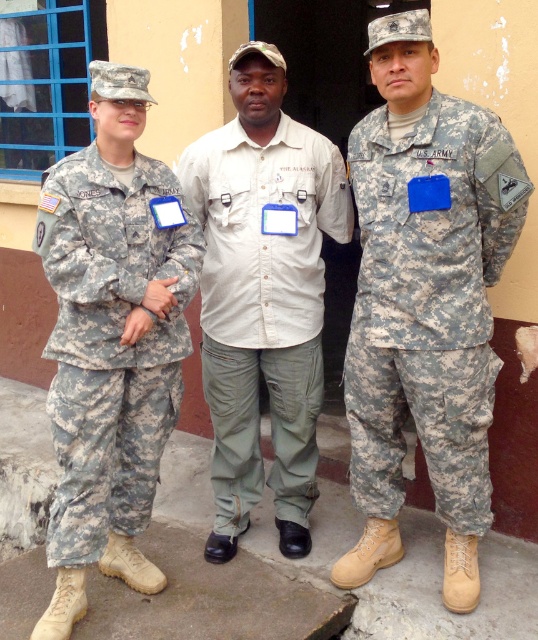
Question: Can you confirm if light beige cotton shirt at center is positioned above camouflage fabric pants at left?

Choices:
 (A) no
 (B) yes

Answer: (B)

Question: Among these points, which one is nearest to the camera?

Choices:
 (A) click(x=468, y=380)
 (B) click(x=285, y=397)

Answer: (A)

Question: Considering the real-world distances, which object is farthest from the camouflage fabric uniform at center?

Choices:
 (A) camouflage fabric pants at left
 (B) light beige cotton shirt at center

Answer: (A)

Question: Is light beige cotton shirt at center below camouflage fabric uniform at center?

Choices:
 (A) no
 (B) yes

Answer: (A)

Question: Among these points, which one is farthest from the camera?

Choices:
 (A) (70, 266)
 (B) (459, 221)

Answer: (B)

Question: Does camouflage fabric uniform at center appear over camouflage fabric pants at left?

Choices:
 (A) yes
 (B) no

Answer: (A)